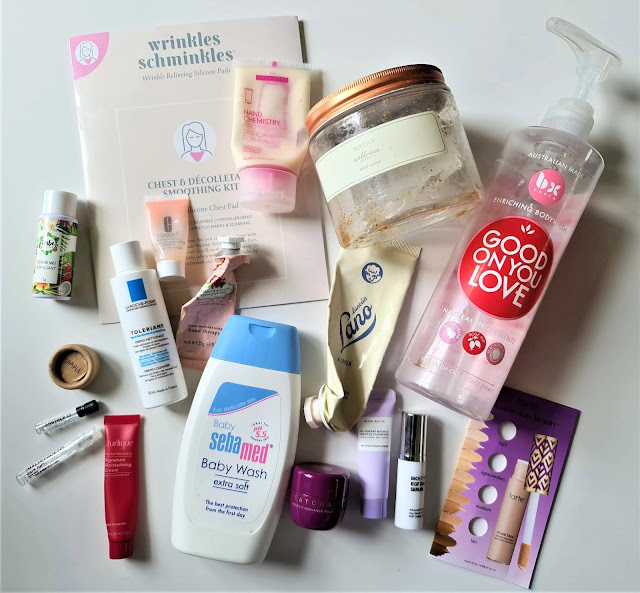
Image resolution: width=640 pixels, height=593 pixels. In order to click on perfume samples in this screenshot , I will do `click(58, 420)`, `click(67, 448)`, `click(121, 503)`.